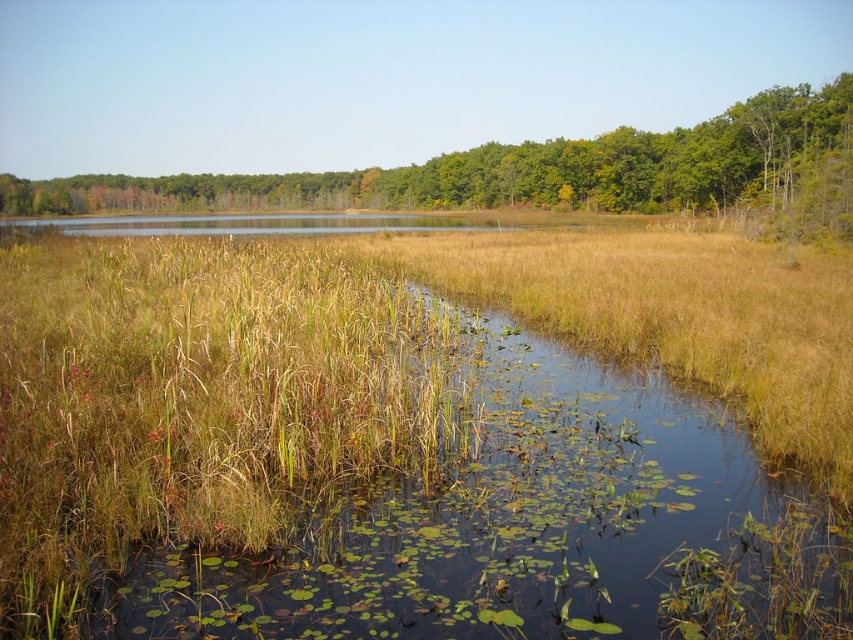
Based on the photo, you are standing at the edge of the marsh and want to cross to the other side. You see green grass at center and green leafy trees at upper center. Which object is taller and could potentially block your view while crossing?

The green leafy trees at upper center are taller than the green grass at center, so they could potentially block your view while crossing.

You are standing at the edge of the marsh and want to reach the green grass at center. Which direction should you move in to get there?

The green grass at center is located at coordinates point (347, 372), so you should move towards the center of the image to reach it.